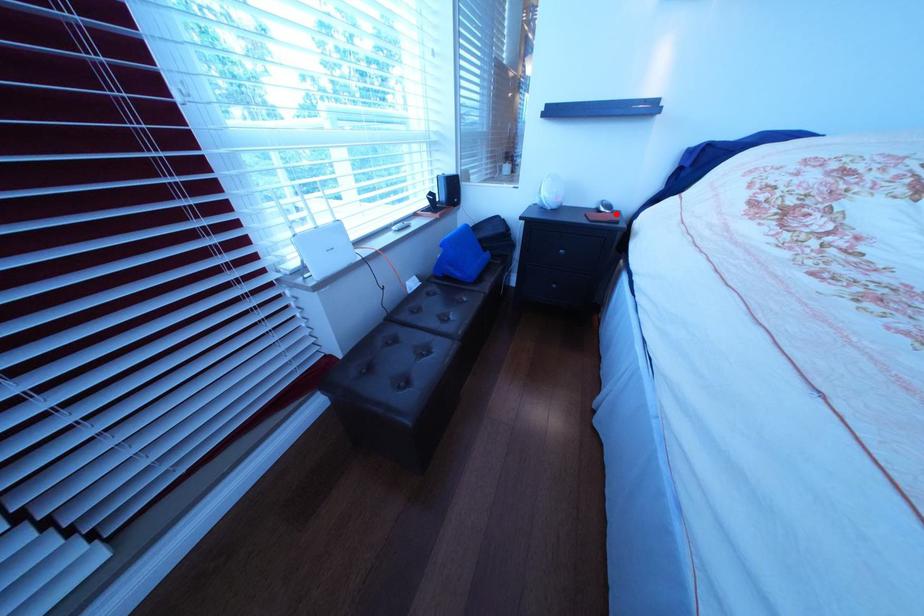
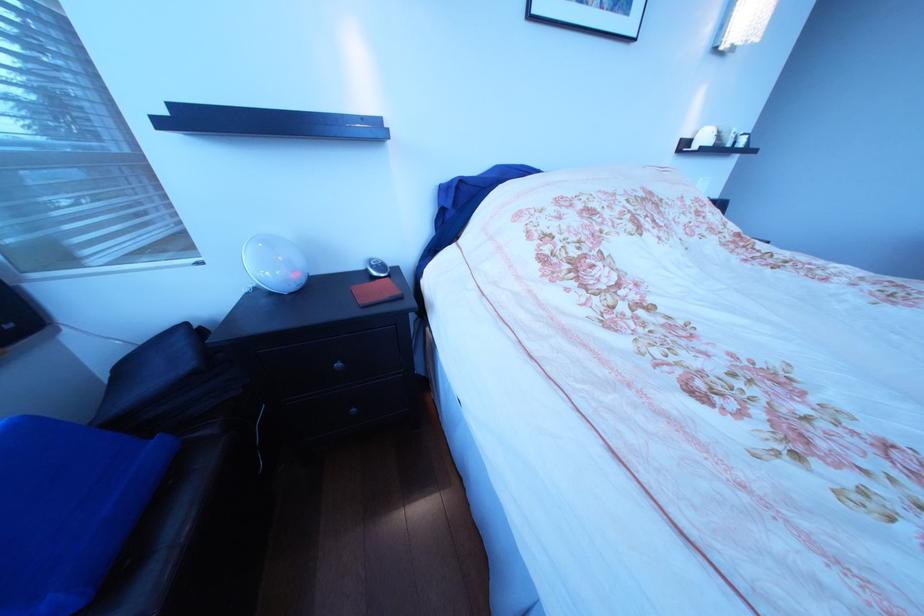
Question: A red point is marked in image1. In image2, is the corresponding 3D point closer to the camera or farther? Reply with the corresponding letter.

Choices:
 (A) The corresponding 3D point is closer.
 (B) The corresponding 3D point is farther.

Answer: (A)